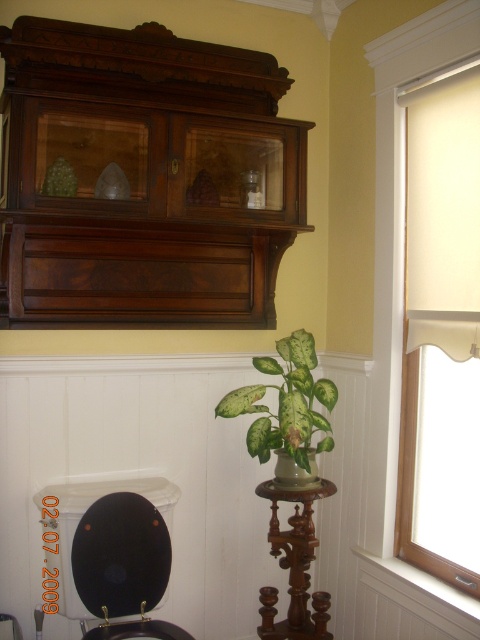
Question: Where is mahogany wood chiffonier at upper left located in relation to green matte leafy plant at center in the image?

Choices:
 (A) below
 (B) above

Answer: (A)

Question: Does mahogany wood chiffonier at upper left lie behind green matte leafy plant at center?

Choices:
 (A) yes
 (B) no

Answer: (B)

Question: Which object appears farthest from the camera in this image?

Choices:
 (A) matte cream roller shade at right
 (B) walnut wood candle holder at lower right
 (C) black glossy toilet bowl at lower left
 (D) green matte leafy plant at center

Answer: (B)

Question: Estimate the real-world distances between objects in this image. Which object is closer to the walnut wood candle holder at lower right?

Choices:
 (A) matte cream roller shade at right
 (B) green matte leafy plant at center
 (C) mahogany wood chiffonier at upper left

Answer: (B)

Question: Does mahogany wood chiffonier at upper left have a lesser width compared to walnut wood candle holder at lower right?

Choices:
 (A) yes
 (B) no

Answer: (B)

Question: Estimate the real-world distances between objects in this image. Which object is closer to the matte cream roller shade at right?

Choices:
 (A) mahogany wood chiffonier at upper left
 (B) black glossy toilet bowl at lower left
 (C) green matte leafy plant at center

Answer: (C)